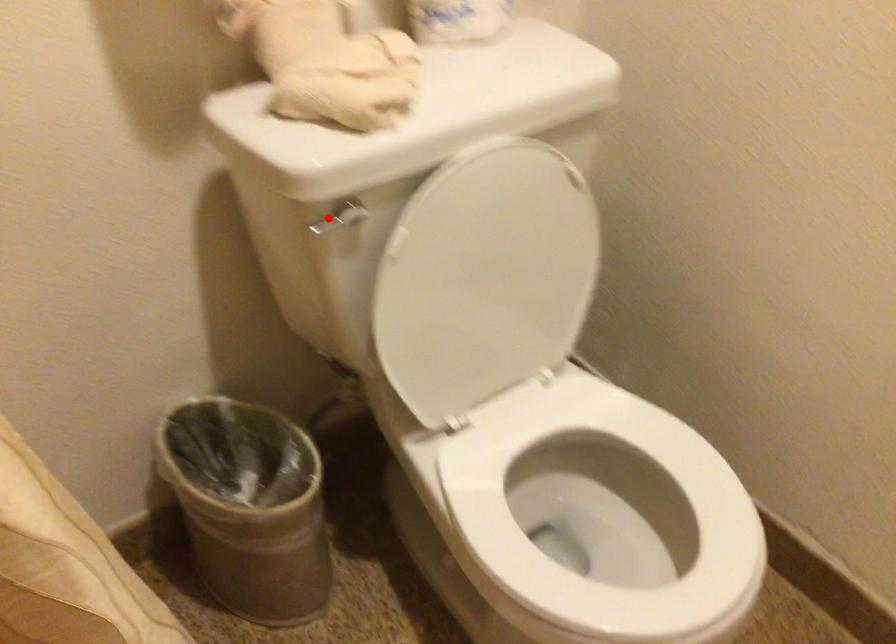
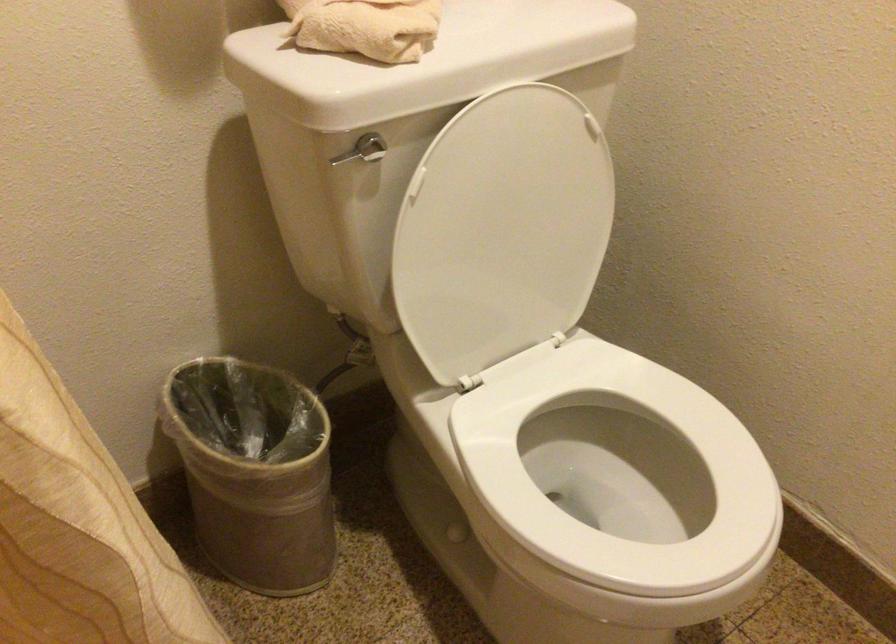
Question: I am providing you with two images of the same scene from different viewpoints. A red point is marked on the first image. At the location where the point appears in image 1, is it still visible in image 2?

Choices:
 (A) Yes
 (B) No

Answer: (A)